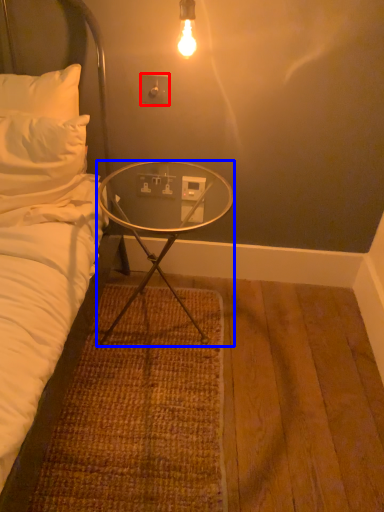
Question: Among these objects, which one is nearest to the camera, electric outlet (highlighted by a red box) or desk (highlighted by a blue box)?

Choices:
 (A) electric outlet
 (B) desk

Answer: (B)